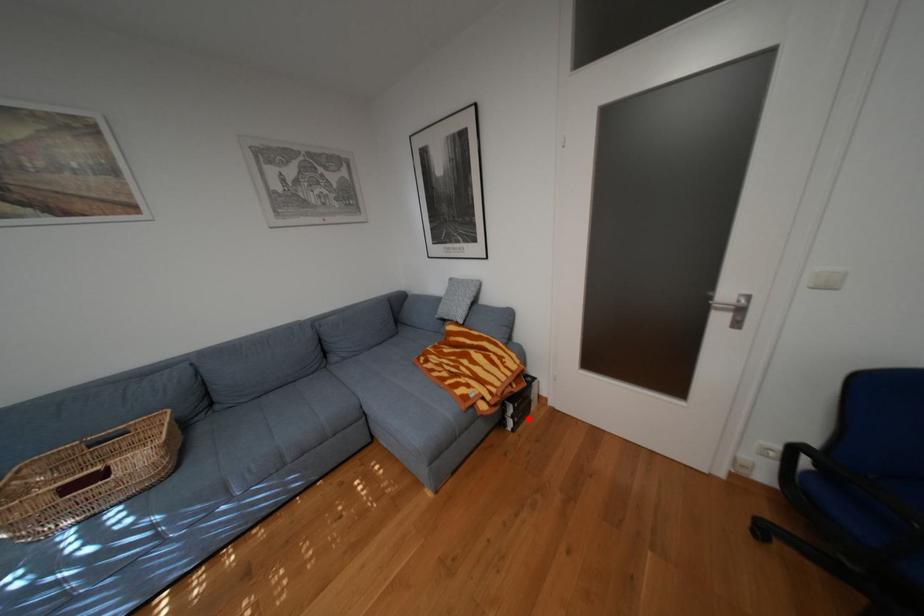
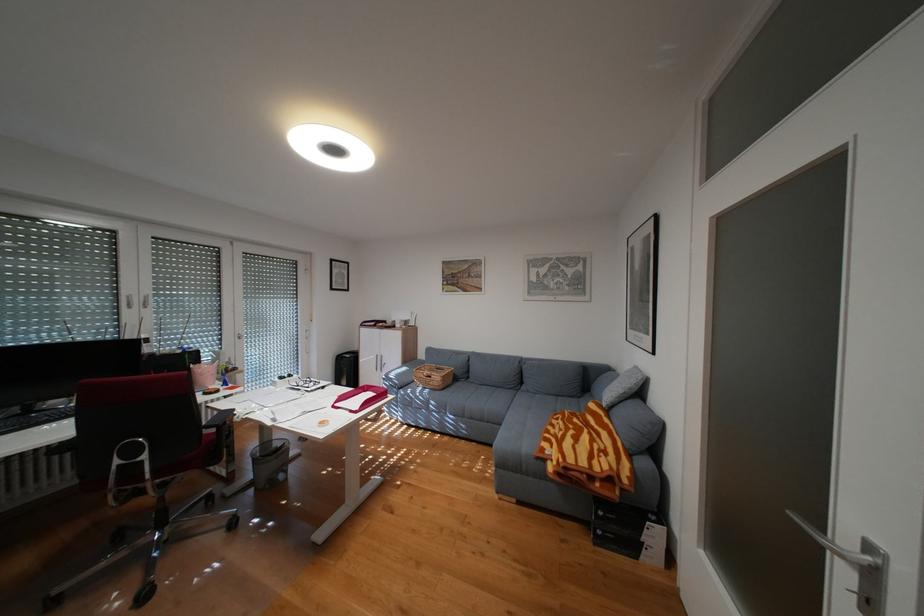
Locate, in the second image, the point that corresponds to the highlighted location in the first image.

(612, 532)